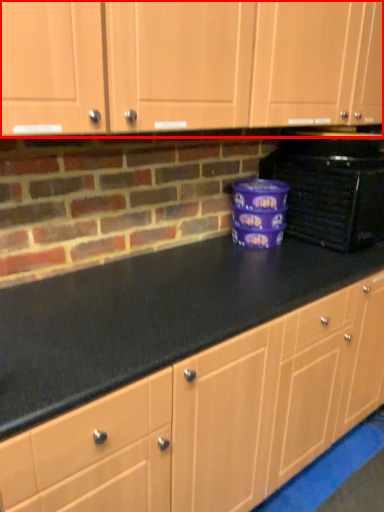
Question: From the image, what is the correct spatial relationship of cabinetry (annotated by the red box) in relation to home appliance?

Choices:
 (A) right
 (B) left

Answer: (B)